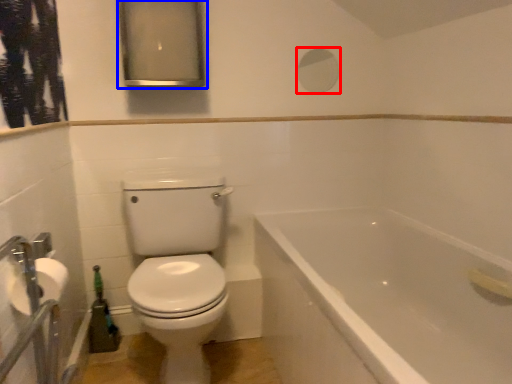
Question: Which object is further to the camera taking this photo, mirror (highlighted by a red box) or medicine cabinet (highlighted by a blue box)?

Choices:
 (A) mirror
 (B) medicine cabinet

Answer: (A)